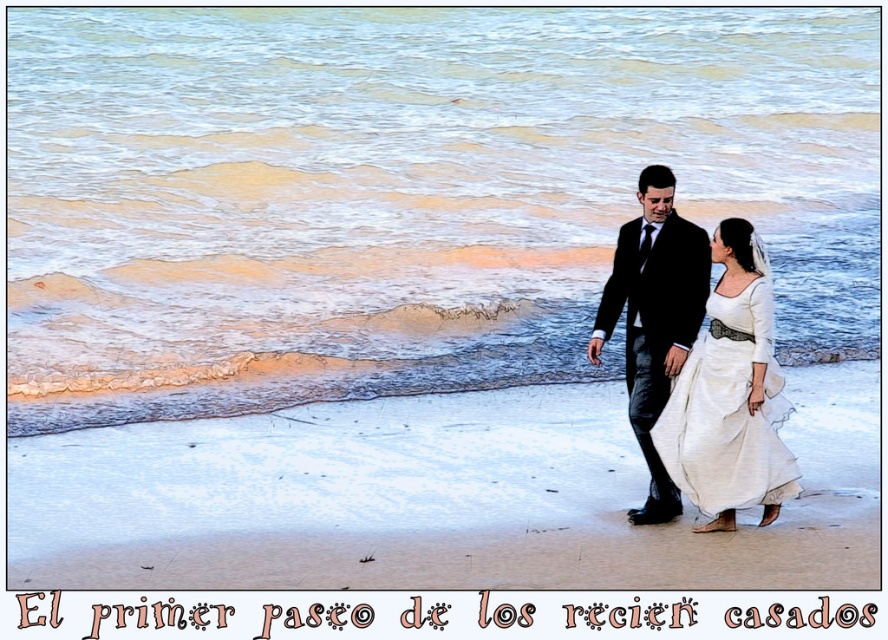
Which is behind, point (736, 365) or point (694, 304)?

Point (694, 304)

Which of these two, white satin dress at lower right or black satin suit at center, stands taller?

With more height is black satin suit at center.

The width and height of the screenshot is (888, 640). What do you see at coordinates (728, 410) in the screenshot? I see `white satin dress at lower right` at bounding box center [728, 410].

Identify the location of white satin dress at lower right. This screenshot has width=888, height=640. (728, 410).